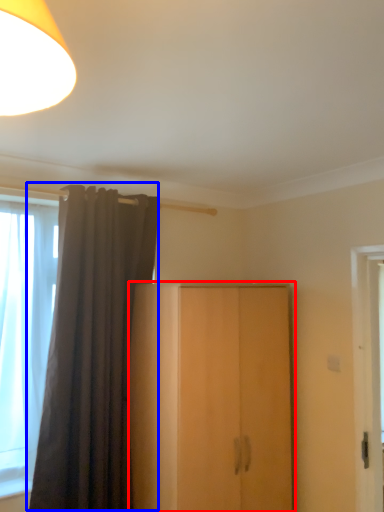
Question: Among these objects, which one is farthest to the camera, cupboard (highlighted by a red box) or curtain (highlighted by a blue box)?

Choices:
 (A) cupboard
 (B) curtain

Answer: (B)